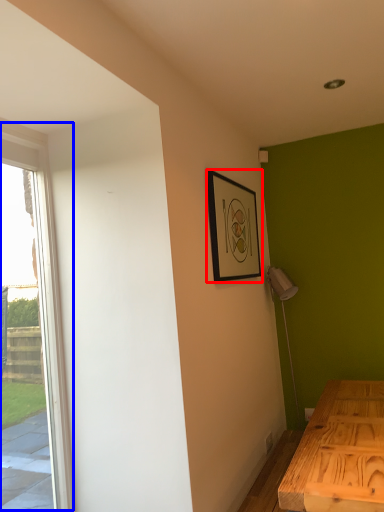
Question: Which of the following is the closest to the observer, picture frame (highlighted by a red box) or window (highlighted by a blue box)?

Choices:
 (A) picture frame
 (B) window

Answer: (B)